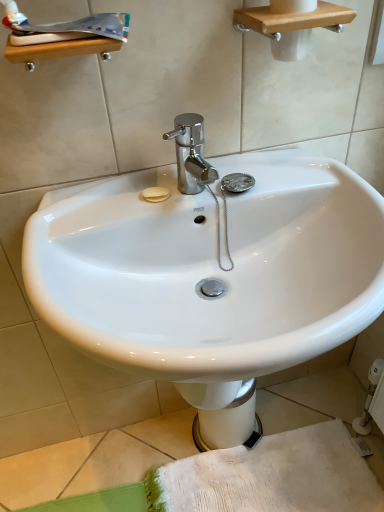
Where is `vacant area located to the right-hand side of white glossy bidet at center`? This screenshot has height=512, width=384. vacant area located to the right-hand side of white glossy bidet at center is located at coordinates (282, 419).